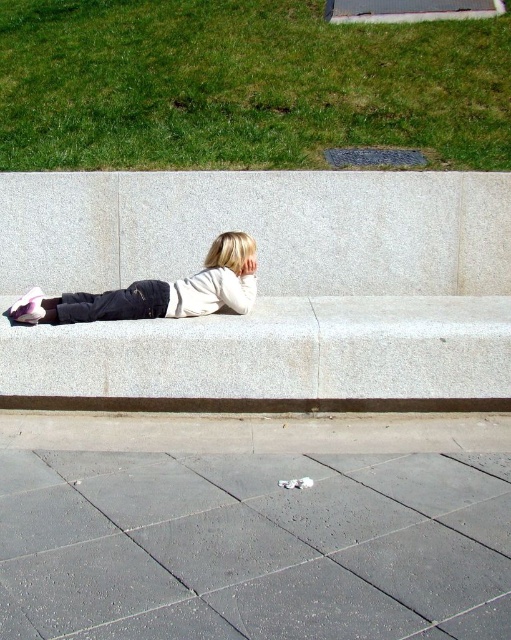
Who is more distant from viewer, (80, 321) or (427, 406)?

Positioned behind is point (80, 321).

Looking at this image, is matte white shirt at center closer to the viewer compared to brown textured curb at lower center?

That is False.

Is point (27, 310) closer to camera compared to point (103, 404)?

Yes, it is in front of point (103, 404).

You are a GUI agent. You are given a task and a screenshot of the screen. Output one action in this format:
    pyautogui.click(x=<x>, y=<y>)
    Task: Click on the matte white shirt at center
    Image resolution: width=511 pixels, height=640 pixels.
    Given the screenshot: What is the action you would take?
    pyautogui.click(x=156, y=291)

Is point (142, 177) less distant than point (31, 404)?

No.

Can you confirm if gray granite bench at center is wider than brown textured curb at lower center?

Correct, the width of gray granite bench at center exceeds that of brown textured curb at lower center.

Who is more distant from viewer, [258,186] or [305,410]?

The point [258,186] is behind.

Identify the location of gray granite bench at center. This screenshot has width=511, height=640. (267, 284).

Does gray granite bench at center appear on the left side of green grass at upper left?

Incorrect, gray granite bench at center is not on the left side of green grass at upper left.

Consider the image. Who is more distant from viewer, (306, 225) or (66, 138)?

The point (66, 138) is more distant.

Locate an element on the screen. The height and width of the screenshot is (640, 511). gray granite bench at center is located at coordinates [x=267, y=284].